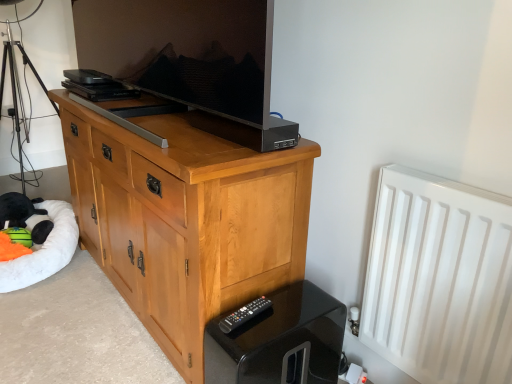
Find the location of `empty space that is in between light wood cabinet at center and white fluffy dog bed at lower left`. empty space that is in between light wood cabinet at center and white fluffy dog bed at lower left is located at coordinates (70, 326).